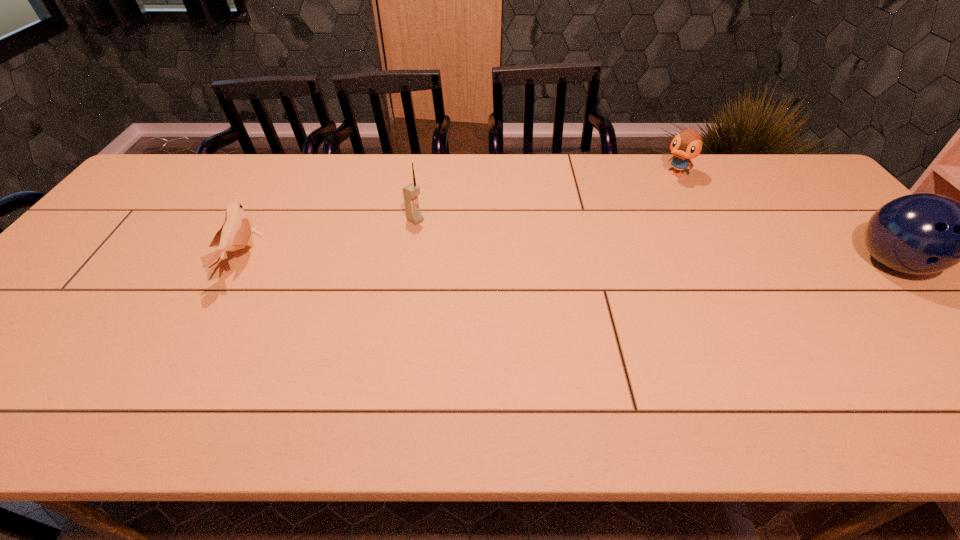
Identify the location of free space located 0.210m on the front of the cellular telephone, where the keypad is located. Image resolution: width=960 pixels, height=540 pixels. (477, 256).

Identify the location of vacant area located on the front of the cellular telephone, where the keypad is located. (513, 278).

Where is `free point located 0.360m on the front-facing side of the second object from right to left`? The height and width of the screenshot is (540, 960). free point located 0.360m on the front-facing side of the second object from right to left is located at coordinates (620, 240).

At what (x,y) coordinates should I click in order to perform the action: click on free space located 0.250m on the front-facing side of the second object from right to left. Please return your answer as a coordinate pair (x, y). Looking at the image, I should click on (637, 220).

Find the location of a particular element. The height and width of the screenshot is (540, 960). free space located on the front-facing side of the second object from right to left is located at coordinates (646, 210).

Image resolution: width=960 pixels, height=540 pixels. What are the coordinates of `object that is positioned at the far edge` in the screenshot? It's located at (687, 144).

This screenshot has height=540, width=960. In order to click on object that is at the right edge in this screenshot , I will do `click(924, 233)`.

In the image, there is a desktop. Where is `free space at the far edge`? This screenshot has height=540, width=960. free space at the far edge is located at coordinates (299, 194).

In the image, there is a desktop. Identify the location of free space at the near edge. (148, 361).

You are a GUI agent. You are given a task and a screenshot of the screen. Output one action in this format:
    pyautogui.click(x=<x>, y=<y>)
    Task: Click on the free space at the right edge
    The width and height of the screenshot is (960, 540).
    Given the screenshot: What is the action you would take?
    pyautogui.click(x=889, y=317)